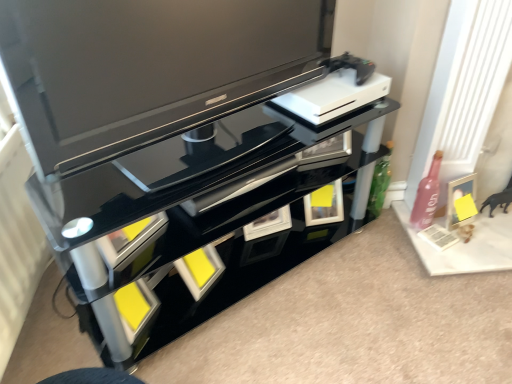
Question: From a real-world perspective, is pink glass bottle at right positioned above or below matte black tv at upper center?

Choices:
 (A) below
 (B) above

Answer: (A)

Question: In terms of height, does pink glass bottle at right look taller or shorter compared to matte black tv at upper center?

Choices:
 (A) tall
 (B) short

Answer: (B)

Question: Which object is positioned closest to the matte silver picture frame at right?

Choices:
 (A) matte black tv at upper center
 (B) pink glass bottle at right

Answer: (B)

Question: Which is farther from the matte silver picture frame at right?

Choices:
 (A) pink glass bottle at right
 (B) matte black tv at upper center

Answer: (B)